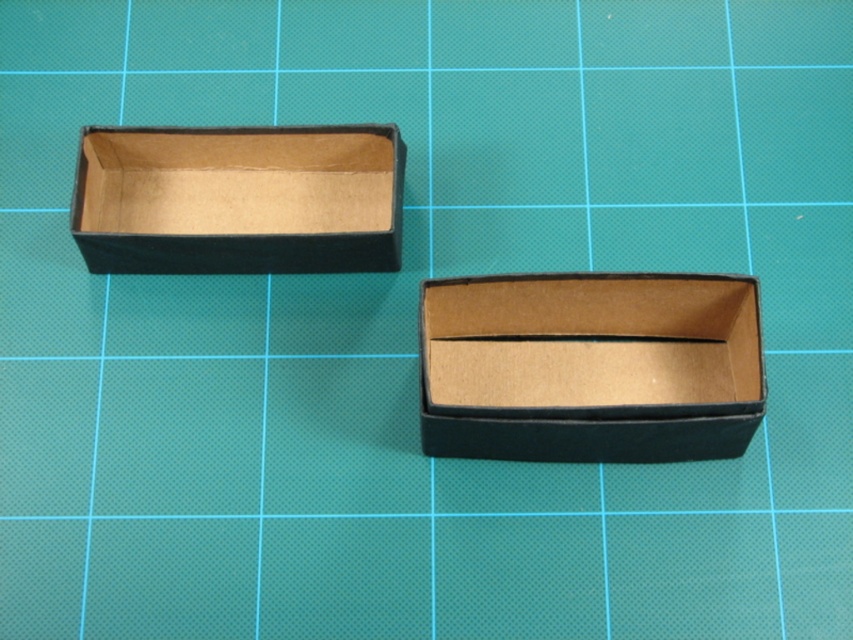
Question: Among these objects, which one is farthest from the camera?

Choices:
 (A) matte black box at upper left
 (B) matte cardboard box at center

Answer: (A)

Question: Which point is closer to the camera?

Choices:
 (A) matte black box at upper left
 (B) matte cardboard box at center

Answer: (B)

Question: Does matte cardboard box at center appear on the right side of matte black box at upper left?

Choices:
 (A) no
 (B) yes

Answer: (B)

Question: Does matte cardboard box at center appear under matte black box at upper left?

Choices:
 (A) yes
 (B) no

Answer: (A)

Question: Can you confirm if matte cardboard box at center is bigger than matte black box at upper left?

Choices:
 (A) no
 (B) yes

Answer: (B)